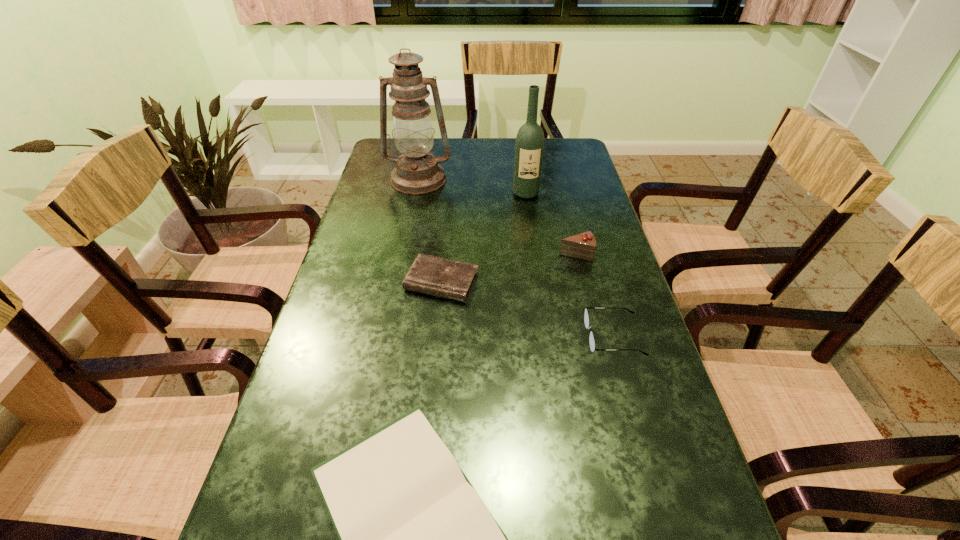
Find the location of `blank space at the far edge`. blank space at the far edge is located at coordinates (493, 141).

Locate an element on the screen. This screenshot has height=540, width=960. free space at the left edge of the desktop is located at coordinates (341, 314).

Identify the location of vacant space at the right edge. (564, 262).

The image size is (960, 540). I want to click on vacant space at the far left corner of the desktop, so click(388, 140).

This screenshot has height=540, width=960. Identify the location of vacant position at the far right corner of the desktop. (575, 152).

What are the coordinates of `free space between the spectacles and the diary` in the screenshot? It's located at (528, 309).

Identify the location of free space between the fifth shortest object and the third tallest object. (551, 224).

Locate an element on the screen. The width and height of the screenshot is (960, 540). free space between the chocolate cake and the diary is located at coordinates (509, 268).

The height and width of the screenshot is (540, 960). Find the location of `free space between the tallest object and the third nearest object`. free space between the tallest object and the third nearest object is located at coordinates (430, 231).

Locate an element on the screen. This screenshot has height=540, width=960. free space between the spectacles and the tallest object is located at coordinates (516, 258).